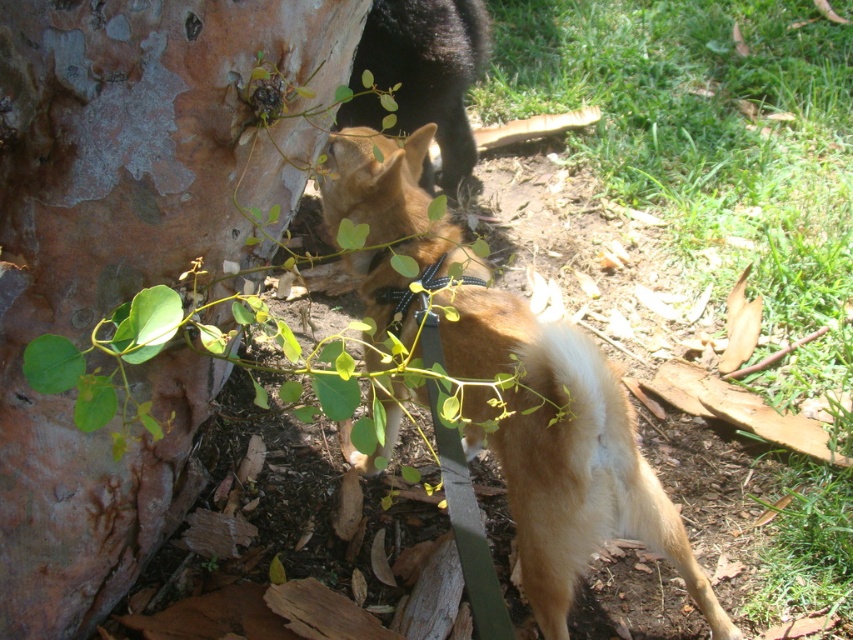
Question: Can you confirm if smooth bark tree trunk at left is positioned to the left of golden fur dog at center?

Choices:
 (A) yes
 (B) no

Answer: (A)

Question: Among these objects, which one is nearest to the camera?

Choices:
 (A) smooth bark tree trunk at left
 (B) golden fur dog at center

Answer: (A)

Question: Which point is closer to the camera taking this photo?

Choices:
 (A) (624, 474)
 (B) (41, 4)

Answer: (B)

Question: Is smooth bark tree trunk at left behind golden fur dog at center?

Choices:
 (A) no
 (B) yes

Answer: (A)

Question: Observing the image, what is the correct spatial positioning of smooth bark tree trunk at left in reference to golden fur dog at center?

Choices:
 (A) below
 (B) above

Answer: (B)